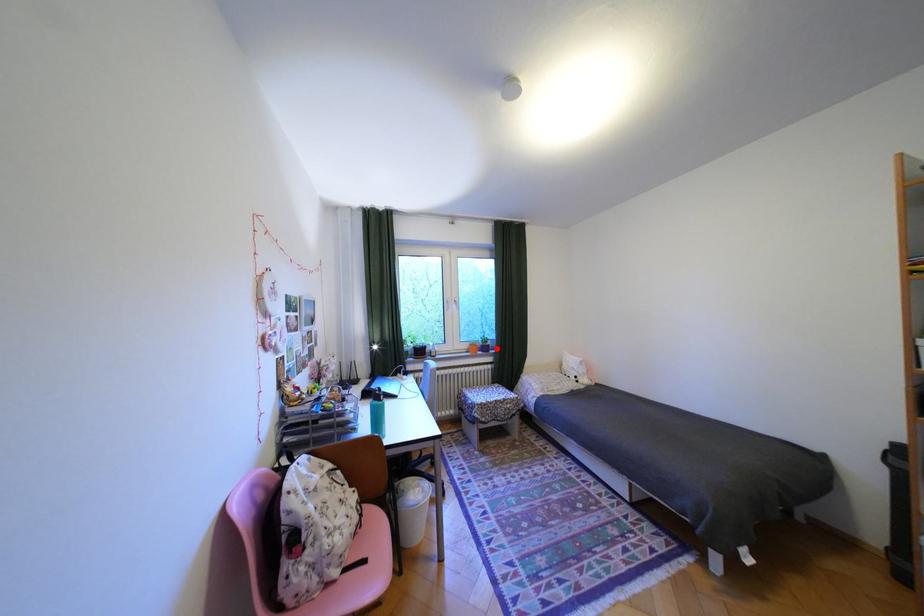
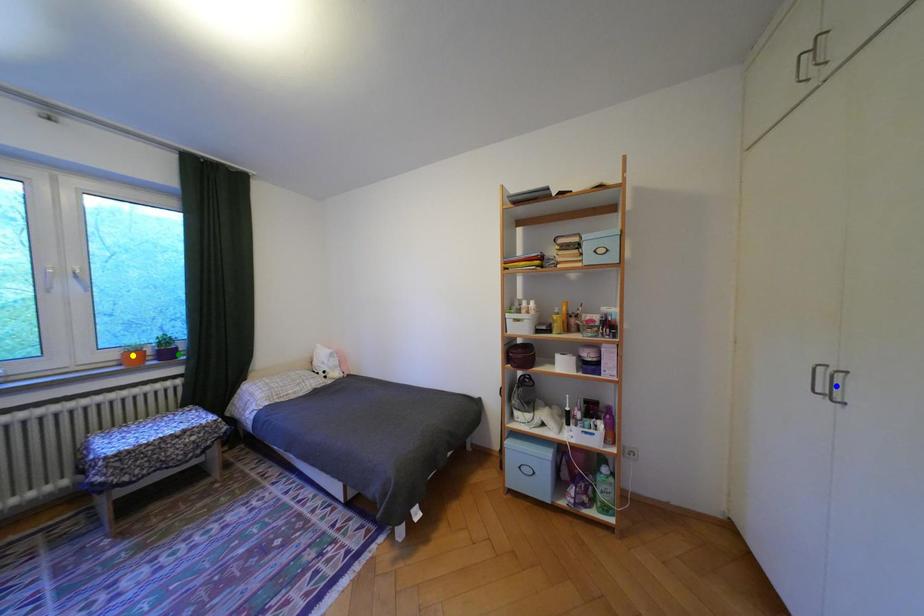
Question: I am providing you with two images of the same scene from different viewpoints. A red point is marked on the first image. You are given multiple points on the second image. Which spot in image 2 lines up with the point in image 1?

Choices:
 (A) blue point
 (B) yellow point
 (C) green point

Answer: (C)